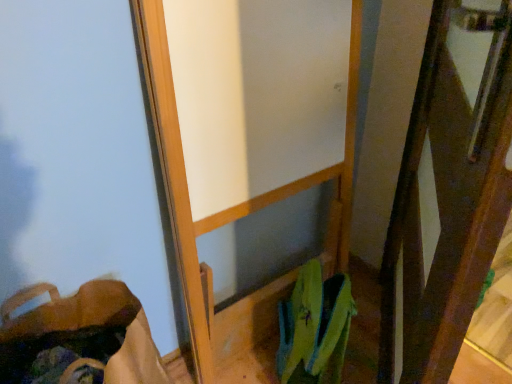
Question: Do you think brown fabric shoulder bag at lower left is within brown wooden screen door at right, or outside of it?

Choices:
 (A) inside
 (B) outside

Answer: (B)

Question: Considering the positions of point (38, 312) and point (392, 216), is point (38, 312) closer or farther from the camera than point (392, 216)?

Choices:
 (A) closer
 (B) farther

Answer: (A)

Question: In terms of size, does brown fabric shoulder bag at lower left appear bigger or smaller than brown wooden screen door at right?

Choices:
 (A) big
 (B) small

Answer: (B)

Question: From a real-world perspective, relative to brown fabric shoulder bag at lower left, is brown wooden screen door at right vertically above or below?

Choices:
 (A) below
 (B) above

Answer: (B)

Question: In terms of size, does brown wooden screen door at right appear bigger or smaller than brown fabric shoulder bag at lower left?

Choices:
 (A) big
 (B) small

Answer: (A)

Question: In terms of width, does brown wooden screen door at right look wider or thinner when compared to brown fabric shoulder bag at lower left?

Choices:
 (A) thin
 (B) wide

Answer: (A)

Question: In terms of height, does brown wooden screen door at right look taller or shorter compared to brown fabric shoulder bag at lower left?

Choices:
 (A) tall
 (B) short

Answer: (A)